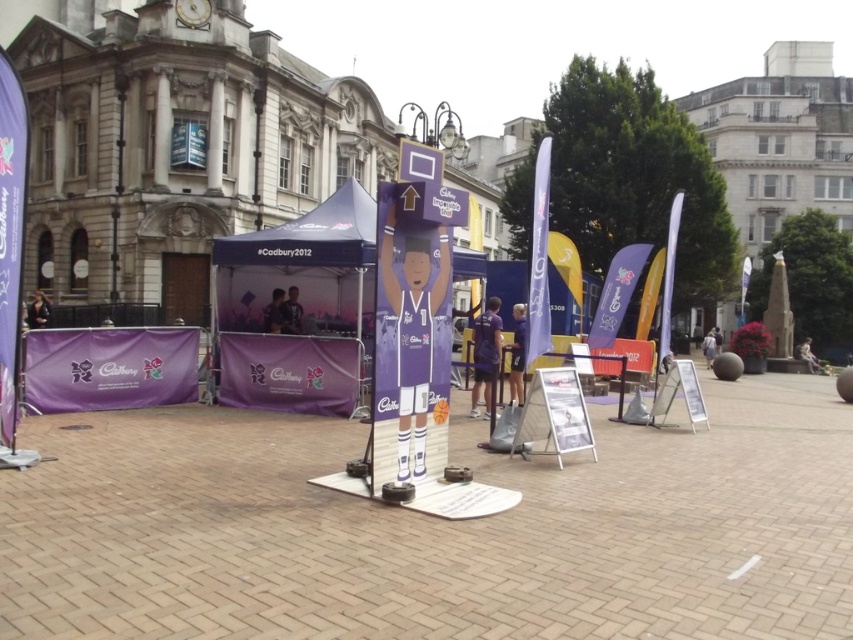
You are standing at the promotional event and want to take a photo of both the life sized cardboard cutout of a basketball player and the booth canopy labeled Cadbury2012. To ensure both are in frame, should you position yourself closer to point (9,173) or point (291,342)?

You should position yourself closer to point (9,173) because point (291,342) is behind it, so placing yourself near the forward point will allow both objects to be visible in the frame.

You are attending the Cadbury event and want to take a photo with the basketball player cutout. The purple fabric tent at center and the purple fabric canopy at left are in your way. Which one should you move to the right to get a clear path to the cutout?

The purple fabric tent at center is to the right of the purple fabric canopy at left, so you should move the purple fabric canopy at left to the right to clear the path.